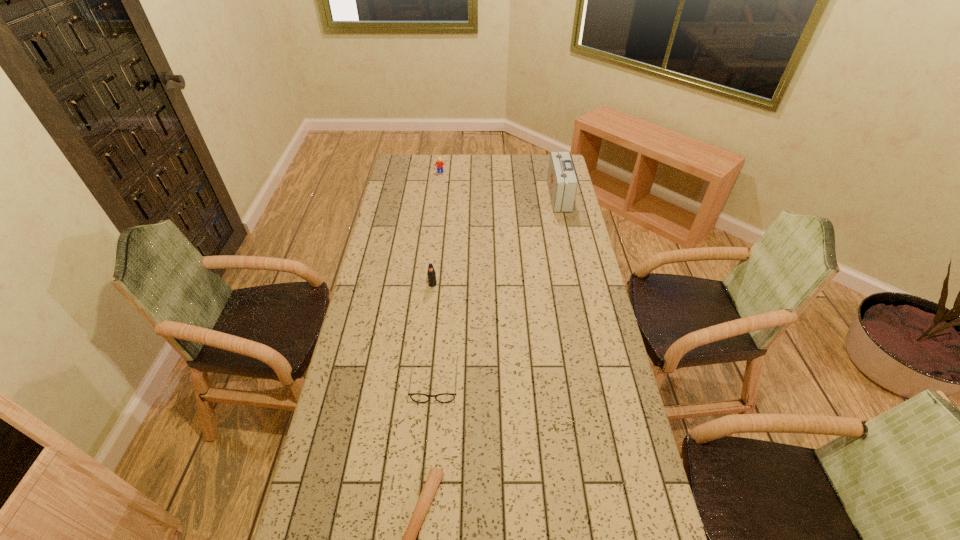
Locate an element on the screen. free point between the third farthest object and the fourth farthest object is located at coordinates (434, 333).

Where is `free spot between the farthest object and the second farthest object`? The width and height of the screenshot is (960, 540). free spot between the farthest object and the second farthest object is located at coordinates (499, 184).

I want to click on vacant point located between the second tallest object and the tallest object, so click(x=495, y=240).

Find the location of a particular element. The width and height of the screenshot is (960, 540). free space between the second tallest object and the first-aid kit is located at coordinates (495, 240).

I want to click on free space that is in between the fourth tallest object and the tallest object, so click(x=497, y=288).

Locate an element on the screen. vacant area between the Lego and the second tallest object is located at coordinates (436, 228).

You are a GUI agent. You are given a task and a screenshot of the screen. Output one action in this format:
    pyautogui.click(x=<x>, y=<y>)
    Task: Click on the object that is the closest one to the nearest object
    The image size is (960, 540).
    Given the screenshot: What is the action you would take?
    pyautogui.click(x=416, y=397)

Choose which object is the third nearest neighbor to the pop. Please provide its 2D coordinates. Your answer should be formatted as a tuple, i.e. [(x, y)], where the tuple contains the x and y coordinates of a point satisfying the conditions above.

[(435, 475)]

The width and height of the screenshot is (960, 540). Find the location of `free point that satisfies the following two spatial constraints: 1. on the front-facing side of the fourth nearest object; 2. on the front label of the third farthest object`. free point that satisfies the following two spatial constraints: 1. on the front-facing side of the fourth nearest object; 2. on the front label of the third farthest object is located at coordinates (579, 285).

You are a GUI agent. You are given a task and a screenshot of the screen. Output one action in this format:
    pyautogui.click(x=<x>, y=<y>)
    Task: Click on the free space that satisfies the following two spatial constraints: 1. on the front-facing side of the second farthest object; 2. through the lenses of the second nearest object
    The image size is (960, 540).
    Given the screenshot: What is the action you would take?
    pyautogui.click(x=600, y=381)